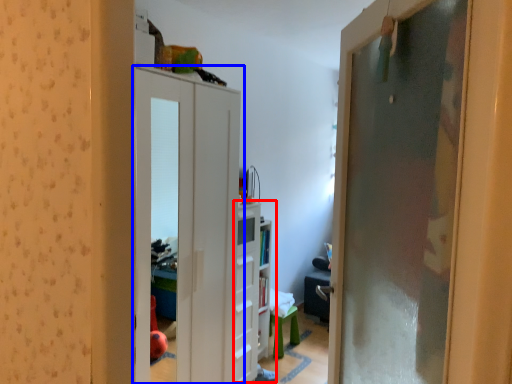
Question: Among these objects, which one is farthest to the camera, dresser (highlighted by a red box) or door (highlighted by a blue box)?

Choices:
 (A) dresser
 (B) door

Answer: (A)